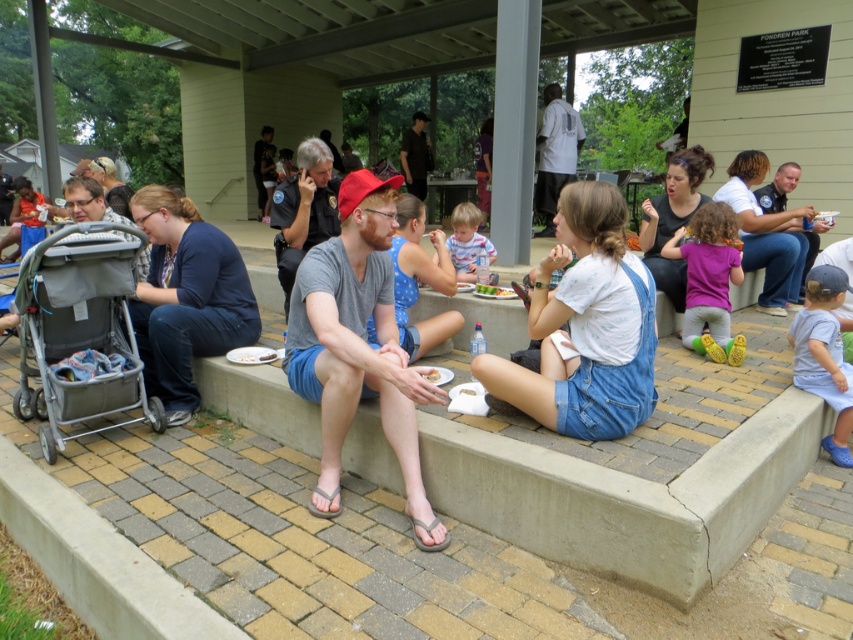
Which is below, blue denim shorts at lower right or light brown hair at center?

Positioned lower is blue denim shorts at lower right.

Is point (827, 376) farther from viewer compared to point (462, 221)?

No, it is in front of (462, 221).

Find the location of a particular element. This screenshot has height=640, width=853. blue denim shorts at lower right is located at coordinates (824, 355).

In the scene shown: Can you confirm if purple cotton shirt at center is positioned above blue denim shorts at lower right?

Yes, purple cotton shirt at center is above blue denim shorts at lower right.

Is purple cotton shirt at center taller than blue denim shorts at lower right?

In fact, purple cotton shirt at center may be shorter than blue denim shorts at lower right.

Is point (698, 268) positioned behind point (828, 356)?

Yes, it is behind point (828, 356).

The height and width of the screenshot is (640, 853). In order to click on purple cotton shirt at center in this screenshot , I will do `click(709, 280)`.

Does purple cotton shirt at center have a greater width compared to light brown hair at center?

In fact, purple cotton shirt at center might be narrower than light brown hair at center.

Is purple cotton shirt at center below light brown hair at center?

Yes, purple cotton shirt at center is below light brown hair at center.

Who is more forward, (737, 268) or (468, 268)?

Point (737, 268) is in front.

You are a GUI agent. You are given a task and a screenshot of the screen. Output one action in this format:
    pyautogui.click(x=<x>, y=<y>)
    Task: Click on the purple cotton shirt at center
    The image size is (853, 640).
    Given the screenshot: What is the action you would take?
    pyautogui.click(x=709, y=280)